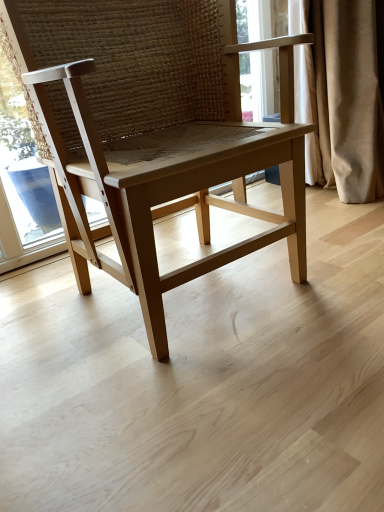
Question: Can you confirm if light wood chair at center is taller than beige velvet curtain at right?

Choices:
 (A) yes
 (B) no

Answer: (A)

Question: Considering the relative sizes of light wood chair at center and beige velvet curtain at right in the image provided, is light wood chair at center wider than beige velvet curtain at right?

Choices:
 (A) yes
 (B) no

Answer: (A)

Question: From a real-world perspective, is light wood chair at center below beige velvet curtain at right?

Choices:
 (A) yes
 (B) no

Answer: (B)

Question: Is light wood chair at center positioned behind beige velvet curtain at right?

Choices:
 (A) yes
 (B) no

Answer: (B)

Question: Does light wood chair at center have a lesser width compared to beige velvet curtain at right?

Choices:
 (A) yes
 (B) no

Answer: (B)

Question: Is the depth of light wood chair at center less than that of beige velvet curtain at right?

Choices:
 (A) no
 (B) yes

Answer: (B)

Question: Is beige velvet curtain at right at the right side of light wood chair at center?

Choices:
 (A) no
 (B) yes

Answer: (B)

Question: Is beige velvet curtain at right completely or partially outside of light wood chair at center?

Choices:
 (A) no
 (B) yes

Answer: (B)

Question: Is beige velvet curtain at right facing away from light wood chair at center?

Choices:
 (A) no
 (B) yes

Answer: (A)

Question: Could light wood chair at center be considered to be inside beige velvet curtain at right?

Choices:
 (A) no
 (B) yes

Answer: (A)

Question: Does beige velvet curtain at right have a greater height compared to light wood chair at center?

Choices:
 (A) no
 (B) yes

Answer: (A)

Question: From a real-world perspective, does beige velvet curtain at right stand above light wood chair at center?

Choices:
 (A) no
 (B) yes

Answer: (A)

Question: From their relative heights in the image, would you say beige velvet curtain at right is taller or shorter than light wood chair at center?

Choices:
 (A) short
 (B) tall

Answer: (A)